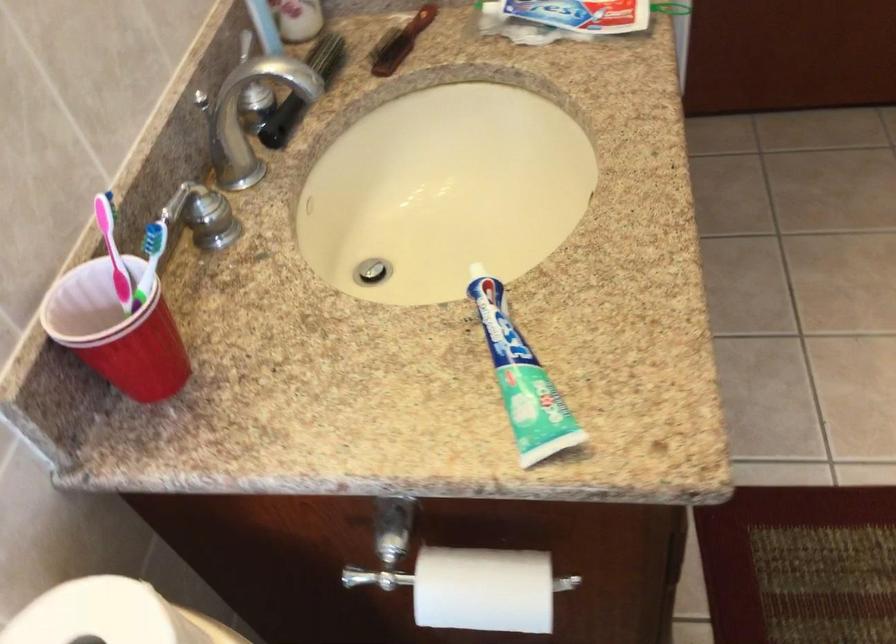
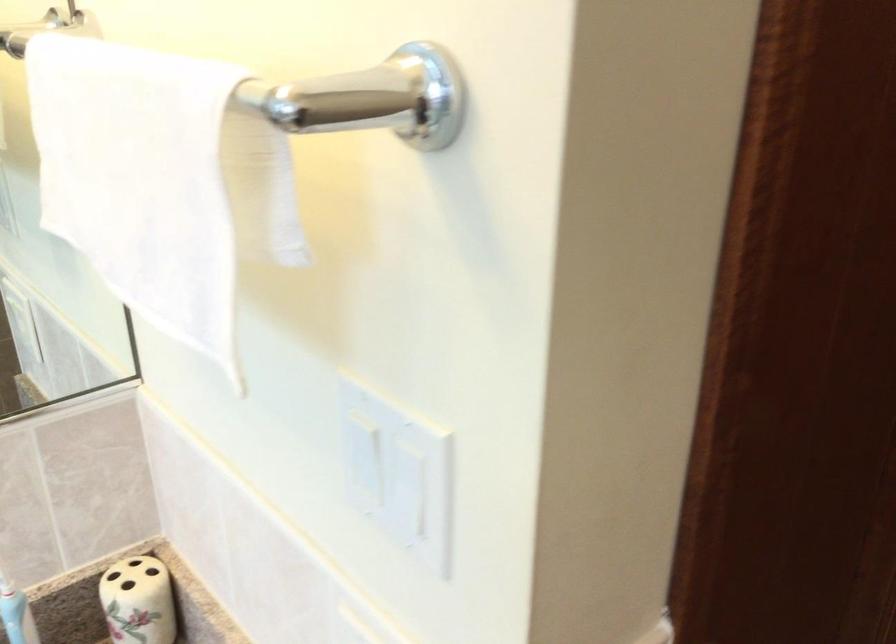
Question: The camera is either moving clockwise (left) or counter-clockwise (right) around the object. The first image is from the beginning of the video and the second image is from the end. Is the camera moving left or right when shooting the video?

Choices:
 (A) Left
 (B) Right

Answer: (B)